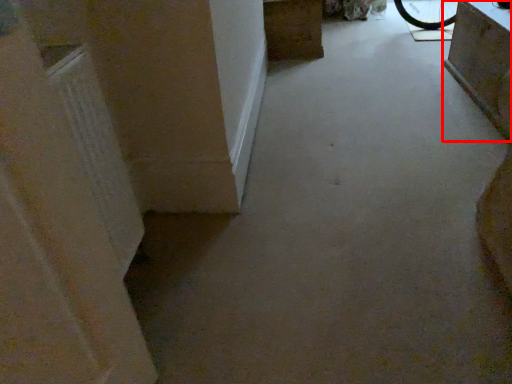
Question: Observing the image, what is the correct spatial positioning of furniture (annotated by the red box) in reference to furniture?

Choices:
 (A) right
 (B) left

Answer: (A)